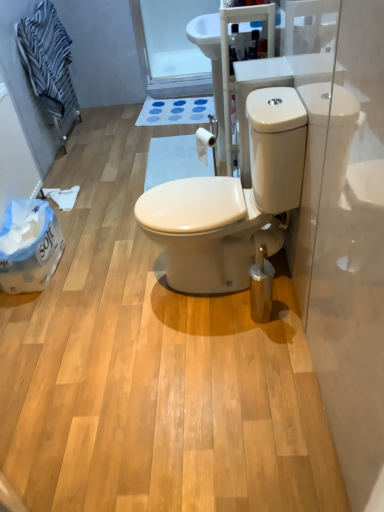
At what (x,y) coordinates should I click in order to perform the action: click on free space to the left of white glossy toilet at center. Please return your answer as a coordinate pair (x, y). The height and width of the screenshot is (512, 384). Looking at the image, I should click on (112, 294).